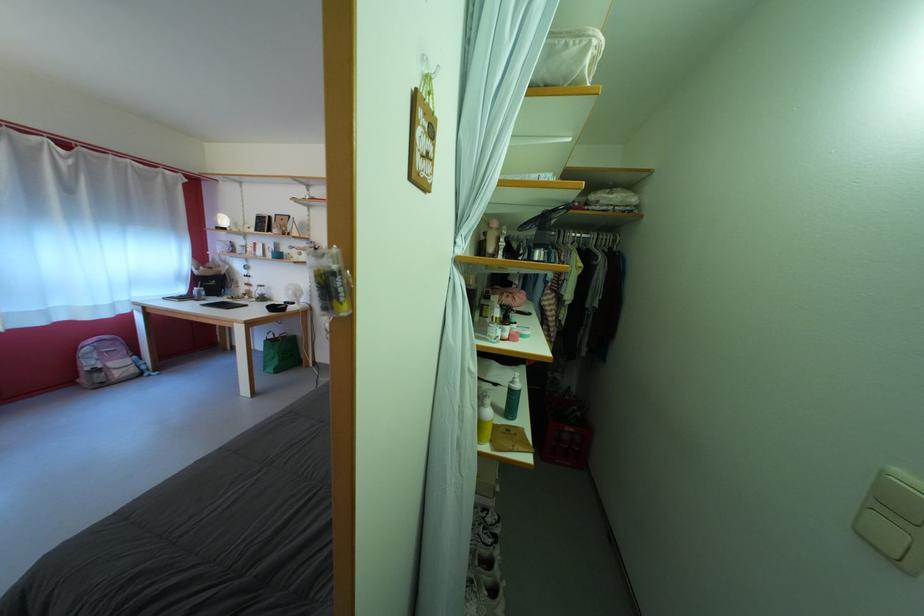
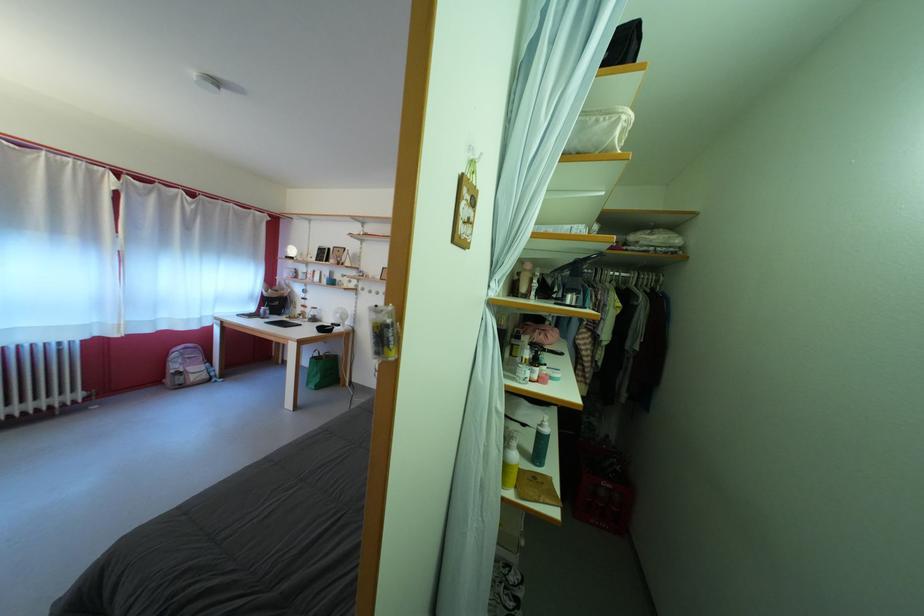
In the second image, find the point that corresponds to (592,241) in the first image.

(631, 281)